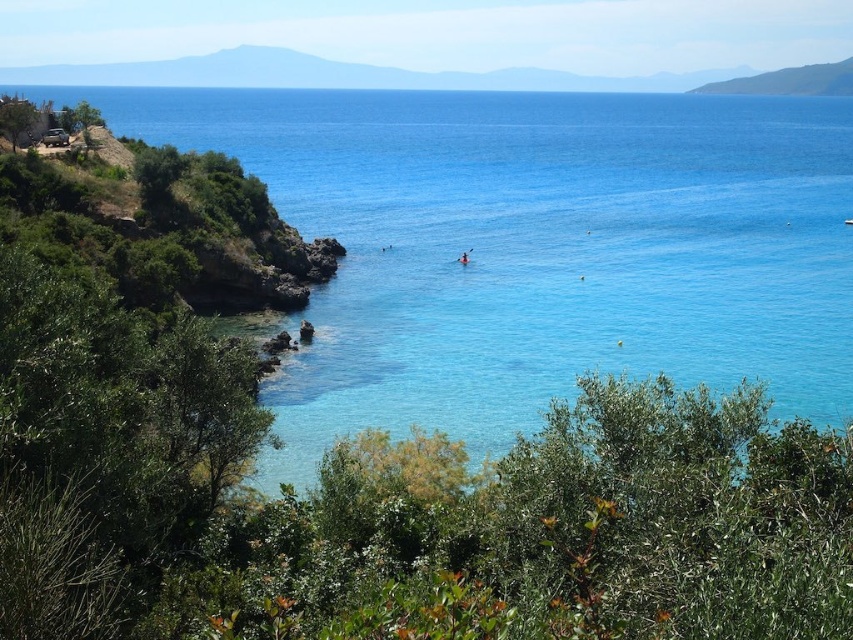
Which is above, clear blue water at center or orange kayak at center?

clear blue water at center is above.

In the scene shown: Which of these two, clear blue water at center or orange kayak at center, stands shorter?

orange kayak at center

Find the location of a particular element. The width and height of the screenshot is (853, 640). clear blue water at center is located at coordinates (534, 248).